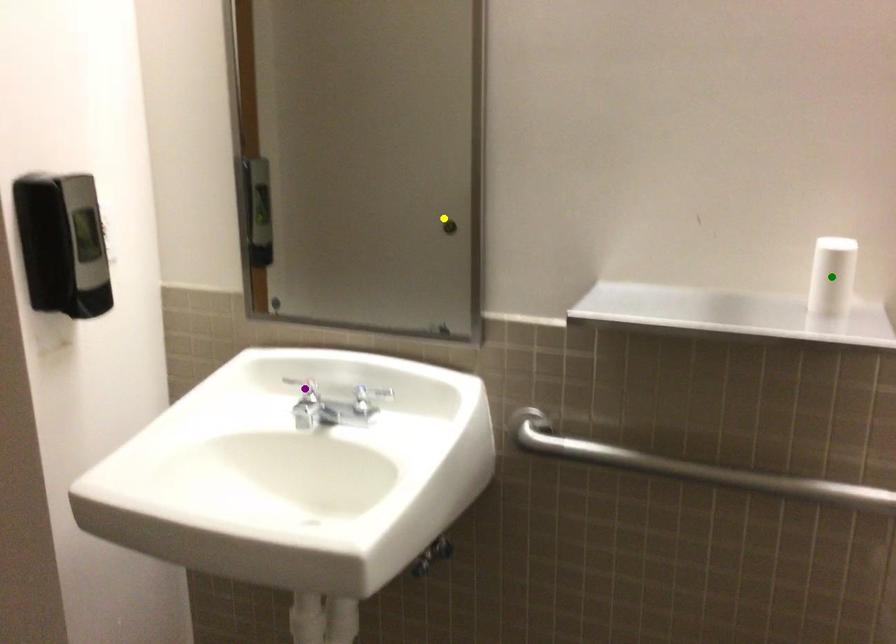
Order these from farthest to nearest:
green point
yellow point
purple point

purple point, yellow point, green point